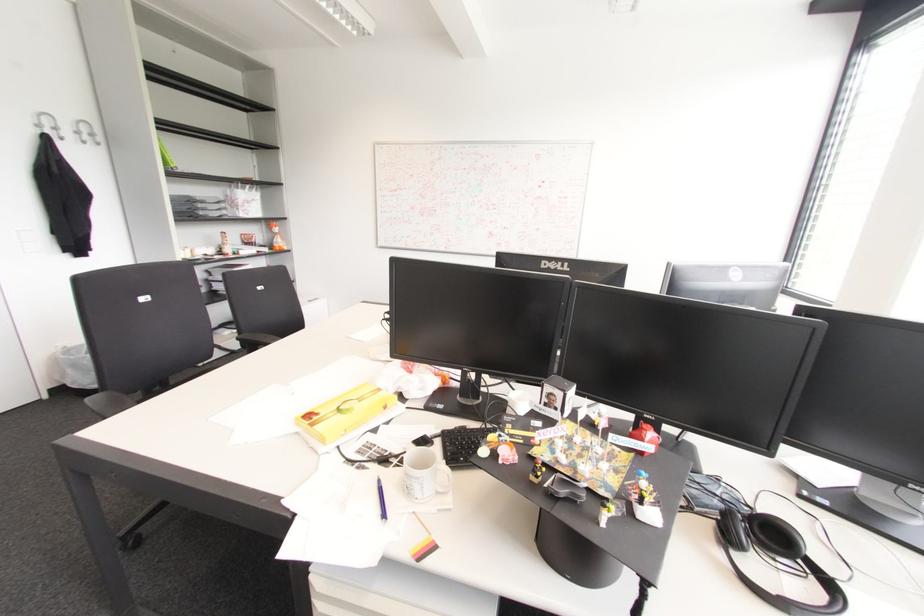
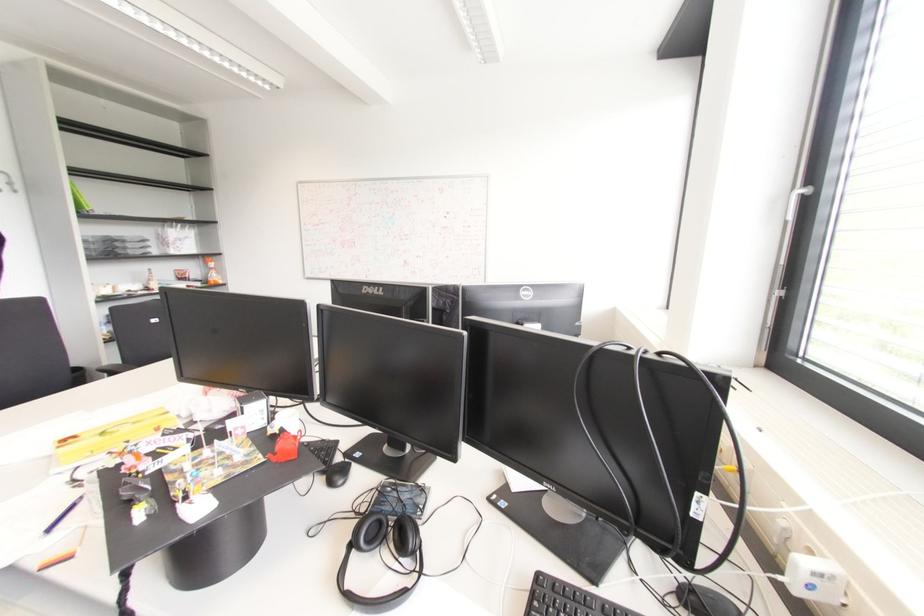
Question: The first image is from the beginning of the video and the second image is from the end. How did the camera likely rotate when shooting the video?

Choices:
 (A) Left
 (B) Right
 (C) Up
 (D) Down

Answer: (C)